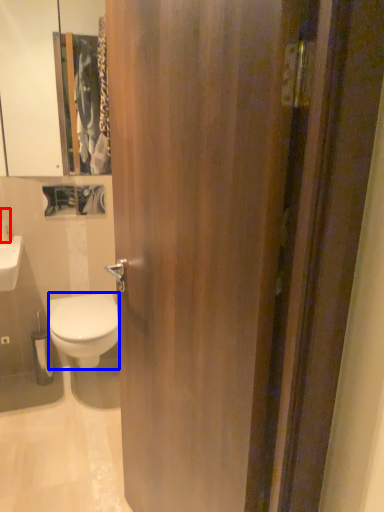
Question: Which point is further to the camera, toiletry (highlighted by a red box) or bidet (highlighted by a blue box)?

Choices:
 (A) toiletry
 (B) bidet

Answer: (A)